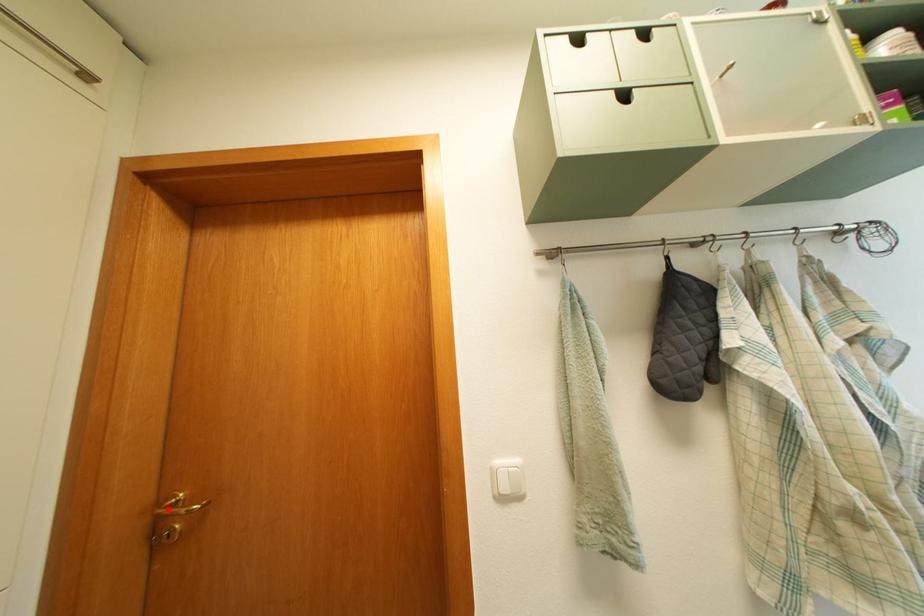
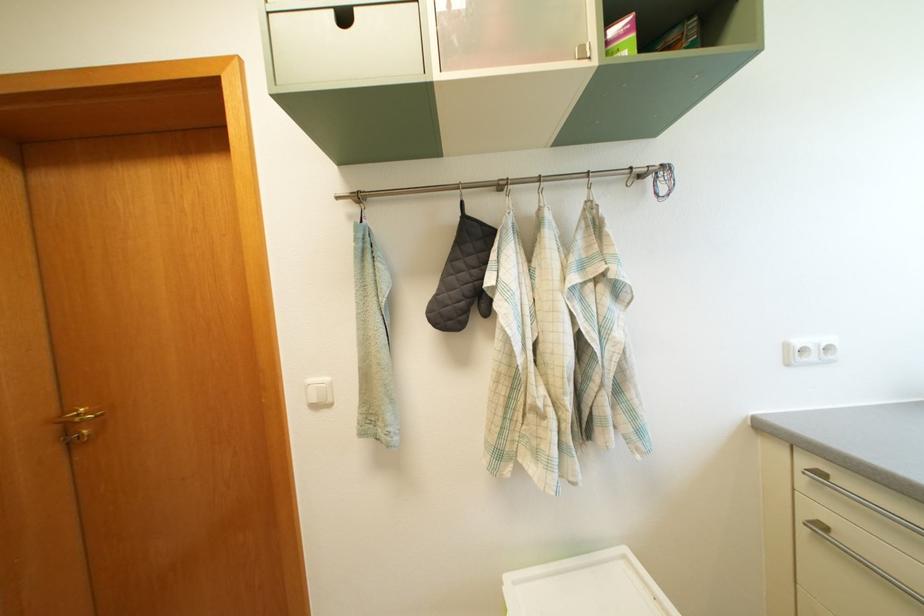
Find the pixel in the second image that matches the highlighted location in the first image.

(71, 422)